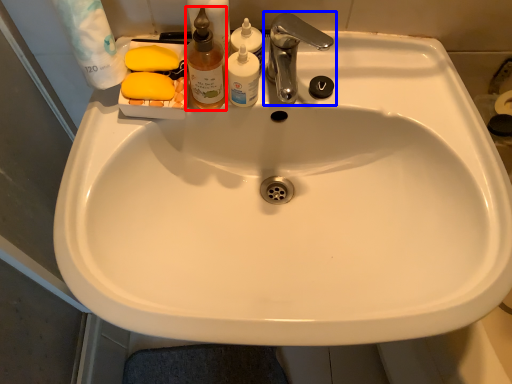
Question: Which object is further to the camera taking this photo, cleaning product (highlighted by a red box) or tap (highlighted by a blue box)?

Choices:
 (A) cleaning product
 (B) tap

Answer: (B)